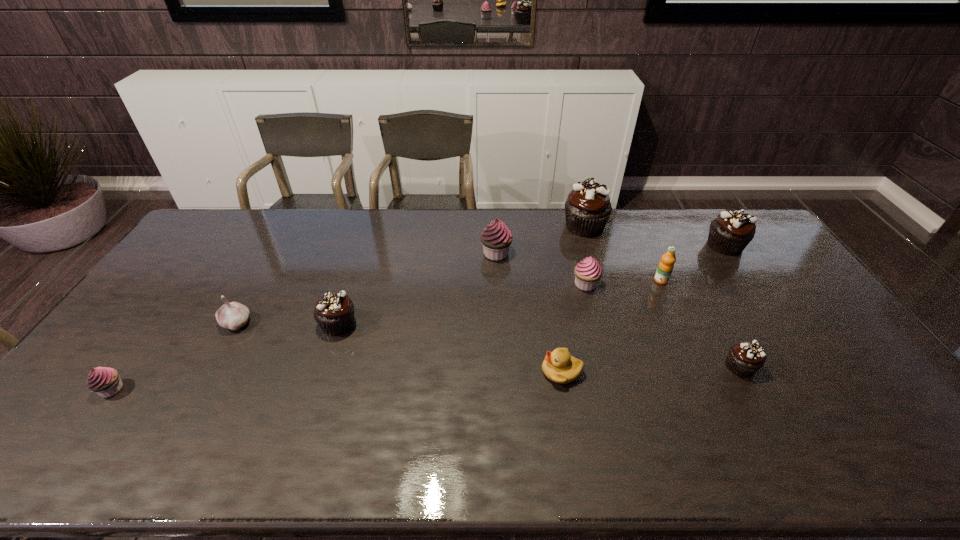
Locate an element on the screen. This screenshot has width=960, height=540. object that is the eighth closest to the rightmost cupcake is located at coordinates (233, 315).

The height and width of the screenshot is (540, 960). I want to click on cupcake that stands as the sixth closest to the rightmost pink cupcake, so click(105, 381).

Locate which cupcake ranks in proximity to the third biggest brown cupcake. Please provide its 2D coordinates. Your answer should be formatted as a tuple, i.e. [(x, y)], where the tuple contains the x and y coordinates of a point satisfying the conditions above.

[(496, 238)]

The height and width of the screenshot is (540, 960). I want to click on brown cupcake object that ranks as the fourth closest to the leftmost cupcake, so click(729, 234).

I want to click on the third closest brown cupcake to the biggest brown cupcake, so click(334, 312).

I want to click on pink cupcake that is the third closest to the garlic, so click(588, 271).

Choose which pink cupcake is the second nearest neighbor to the second smallest brown cupcake. Please provide its 2D coordinates. Your answer should be formatted as a tuple, i.e. [(x, y)], where the tuple contains the x and y coordinates of a point satisfying the conditions above.

[(105, 381)]

Where is `free space that satisfies the following two spatial constraints: 1. on the front side of the fourth object from left to right; 2. on the right side of the third brown cupcake from left to right`? Image resolution: width=960 pixels, height=540 pixels. free space that satisfies the following two spatial constraints: 1. on the front side of the fourth object from left to right; 2. on the right side of the third brown cupcake from left to right is located at coordinates (501, 367).

The height and width of the screenshot is (540, 960). In order to click on free space that satisfies the following two spatial constraints: 1. on the back side of the leftmost object; 2. on the right side of the rightmost object in this screenshot , I will do `click(215, 246)`.

You are a GUI agent. You are given a task and a screenshot of the screen. Output one action in this format:
    pyautogui.click(x=<x>, y=<y>)
    Task: Click on the vacant space that satisfies the following two spatial constraints: 1. on the front side of the eighth object from right to left; 2. on the right side of the garlic
    The image size is (960, 540).
    Given the screenshot: What is the action you would take?
    pyautogui.click(x=236, y=324)